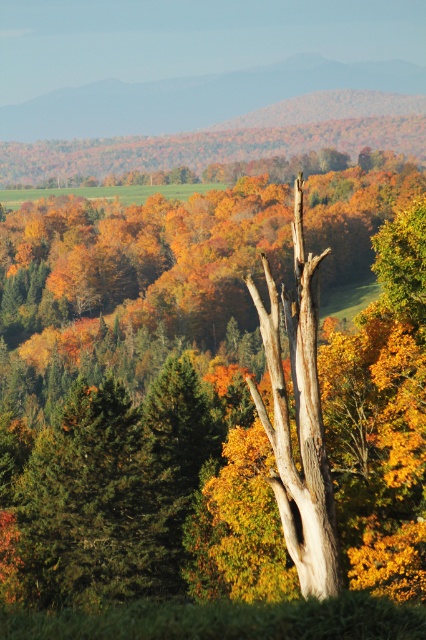
Question: Among these points, which one is nearest to the camera?

Choices:
 (A) (58, 381)
 (B) (126, 490)

Answer: (B)

Question: Considering the relative positions of smooth bark tree at center and green matte tree at left in the image provided, where is smooth bark tree at center located with respect to green matte tree at left?

Choices:
 (A) left
 (B) right

Answer: (B)

Question: Does smooth bark tree at center appear over green matte tree at left?

Choices:
 (A) yes
 (B) no

Answer: (A)

Question: Which point appears farthest from the camera in this image?

Choices:
 (A) tap(195, 580)
 (B) tap(123, 456)

Answer: (B)

Question: Is smooth bark tree at center above green matte tree at left?

Choices:
 (A) no
 (B) yes

Answer: (B)